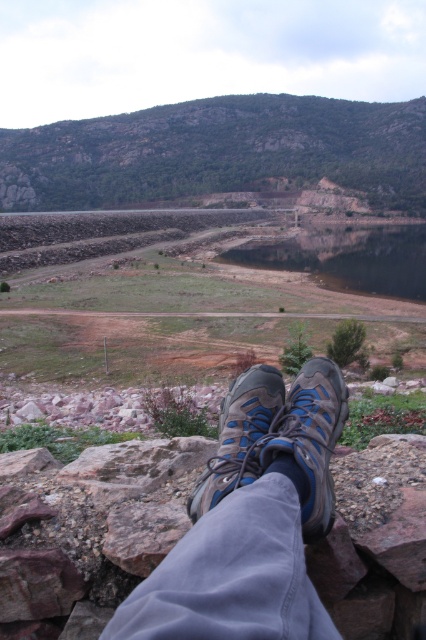
Question: Estimate the real-world distances between objects in this image. Which object is farther from the blue mesh shoe at center?

Choices:
 (A) blue suede shoes at center
 (B) blue mesh shoe at lower center

Answer: (B)

Question: From the image, what is the correct spatial relationship of smooth reflective water at center in relation to blue mesh shoe at center?

Choices:
 (A) right
 (B) left

Answer: (A)

Question: Does blue suede shoes at center appear on the right side of blue mesh shoe at center?

Choices:
 (A) no
 (B) yes

Answer: (A)

Question: Is smooth reflective water at center to the right of blue mesh shoe at lower center from the viewer's perspective?

Choices:
 (A) yes
 (B) no

Answer: (A)

Question: Which of the following is the farthest from the observer?

Choices:
 (A) (307, 502)
 (B) (391, 282)
 (C) (298, 563)
 (D) (253, 381)

Answer: (B)

Question: Which of the following is the closest to the observer?

Choices:
 (A) (219, 499)
 (B) (169, 621)
 (C) (325, 428)
 (D) (330, 250)

Answer: (B)